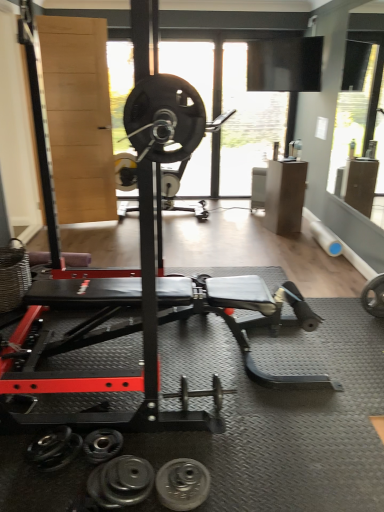
Question: Is the position of transparent glass window screen at upper center less distant than that of black rubber dumbbell at lower center, the 1th dumbbell from the front?

Choices:
 (A) no
 (B) yes

Answer: (A)

Question: Considering the relative sizes of transparent glass window screen at upper center and black rubber dumbbell at lower center, the 1th dumbbell from the front, in the image provided, is transparent glass window screen at upper center taller than black rubber dumbbell at lower center, the 1th dumbbell from the front,?

Choices:
 (A) no
 (B) yes

Answer: (B)

Question: Considering the relative sizes of transparent glass window screen at upper center and black rubber dumbbell at lower center, which is the third dumbbell from back to front, in the image provided, is transparent glass window screen at upper center thinner than black rubber dumbbell at lower center, which is the third dumbbell from back to front,?

Choices:
 (A) no
 (B) yes

Answer: (B)

Question: Can you confirm if transparent glass window screen at upper center is positioned to the right of black rubber dumbbell at lower center, which appears as the first dumbbell when ordered from the bottom?

Choices:
 (A) yes
 (B) no

Answer: (A)

Question: From a real-world perspective, is transparent glass window screen at upper center physically below black rubber dumbbell at lower center, which appears as the first dumbbell when ordered from the bottom?

Choices:
 (A) no
 (B) yes

Answer: (A)

Question: Visually, is transparent glass window screen at upper center positioned to the left or to the right of silver metallic dumbbell at center, which is the first dumbbell in right-to-left order?

Choices:
 (A) right
 (B) left

Answer: (A)

Question: Considering the positions of transparent glass window screen at upper center and silver metallic dumbbell at center, the 1th dumbbell positioned from the top, in the image, is transparent glass window screen at upper center wider or thinner than silver metallic dumbbell at center, the 1th dumbbell positioned from the top,?

Choices:
 (A) thin
 (B) wide

Answer: (A)

Question: Is transparent glass window screen at upper center taller or shorter than silver metallic dumbbell at center, the first dumbbell when ordered from back to front?

Choices:
 (A) tall
 (B) short

Answer: (A)

Question: From the image's perspective, is transparent glass window screen at upper center above or below silver metallic dumbbell at center, which is the first dumbbell in right-to-left order?

Choices:
 (A) below
 (B) above

Answer: (B)

Question: Considering the relative positions of silver metallic dumbbell at center, which appears as the third dumbbell when viewed from the left, and black rubber dumbbell at lower center, which is the third dumbbell from back to front, in the image provided, is silver metallic dumbbell at center, which appears as the third dumbbell when viewed from the left, to the left or to the right of black rubber dumbbell at lower center, which is the third dumbbell from back to front,?

Choices:
 (A) left
 (B) right

Answer: (B)

Question: Considering the positions of point (216, 385) and point (119, 501), is point (216, 385) closer or farther from the camera than point (119, 501)?

Choices:
 (A) closer
 (B) farther

Answer: (B)

Question: From a real-world perspective, is silver metallic dumbbell at center, the 3th dumbbell when ordered from bottom to top, positioned above or below black rubber dumbbell at lower center, positioned as the second dumbbell in left-to-right order?

Choices:
 (A) below
 (B) above

Answer: (B)

Question: Looking at their shapes, would you say silver metallic dumbbell at center, which appears as the third dumbbell when viewed from the left, is wider or thinner than black rubber dumbbell at lower center, which appears as the first dumbbell when ordered from the bottom?

Choices:
 (A) wide
 (B) thin

Answer: (A)

Question: Considering the positions of transparent glass window screen at upper center and black rubber dumbbell at lower center, positioned as the second dumbbell in left-to-right order, in the image, is transparent glass window screen at upper center wider or thinner than black rubber dumbbell at lower center, positioned as the second dumbbell in left-to-right order,?

Choices:
 (A) wide
 (B) thin

Answer: (B)

Question: In terms of height, does transparent glass window screen at upper center look taller or shorter compared to black rubber dumbbell at lower center, positioned as the second dumbbell in left-to-right order?

Choices:
 (A) short
 (B) tall

Answer: (B)